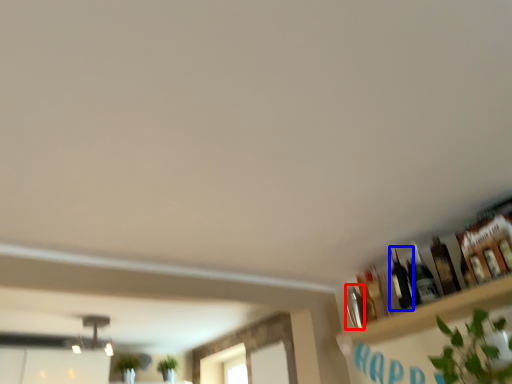
Question: Among these objects, which one is farthest to the camera, bottle (highlighted by a red box) or bottle (highlighted by a blue box)?

Choices:
 (A) bottle
 (B) bottle

Answer: (A)